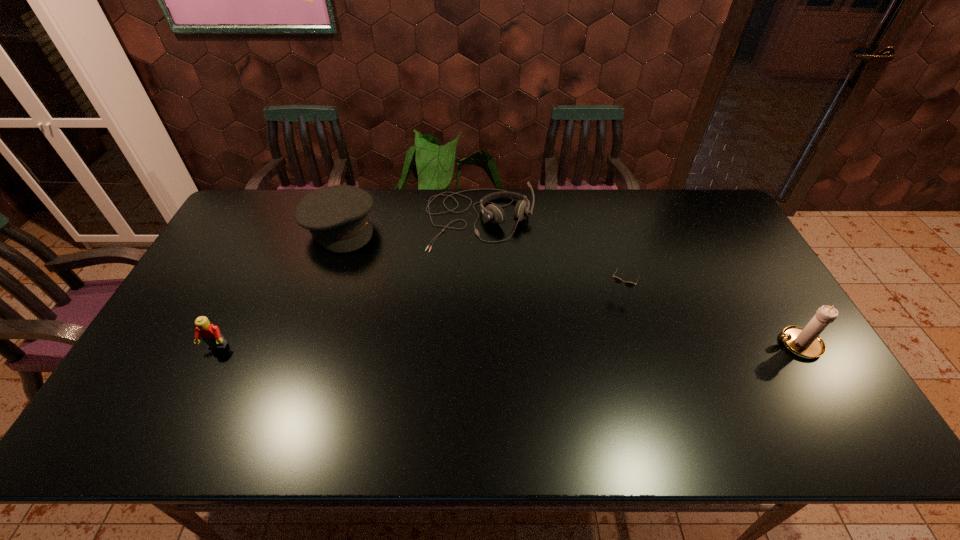
Image resolution: width=960 pixels, height=540 pixels. What are the coordinates of `Lego` in the screenshot? It's located at [210, 334].

This screenshot has height=540, width=960. Identify the location of the tallest object. (805, 342).

Locate an element on the screen. The width and height of the screenshot is (960, 540). candle holder is located at coordinates (805, 342).

At what (x,y) coordinates should I click in order to perform the action: click on the fourth object from left to right. Please return your answer as a coordinate pair (x, y). The height and width of the screenshot is (540, 960). Looking at the image, I should click on (628, 284).

The width and height of the screenshot is (960, 540). I want to click on sunglasses, so 628,284.

Where is `the second object from left to right`? the second object from left to right is located at coordinates (337, 217).

This screenshot has width=960, height=540. What are the coordinates of `the third object from right to left` in the screenshot? It's located at (493, 212).

At what (x,y) coordinates should I click in order to perform the action: click on vacant space situated on the face of the Lego. Please return your answer as a coordinate pair (x, y). Looking at the image, I should click on (195, 391).

Where is `vacant region located 0.330m on the handle side of the candle holder`? vacant region located 0.330m on the handle side of the candle holder is located at coordinates (650, 344).

The width and height of the screenshot is (960, 540). Identify the location of vacant space located 0.370m on the handle side of the candle holder. (635, 344).